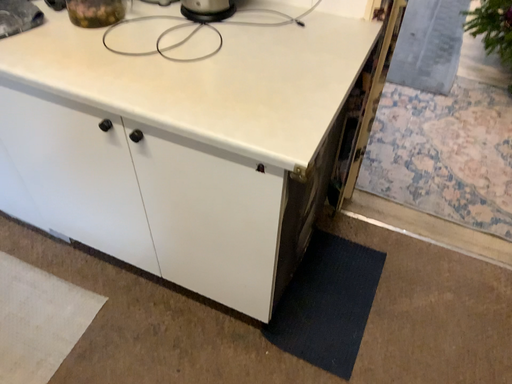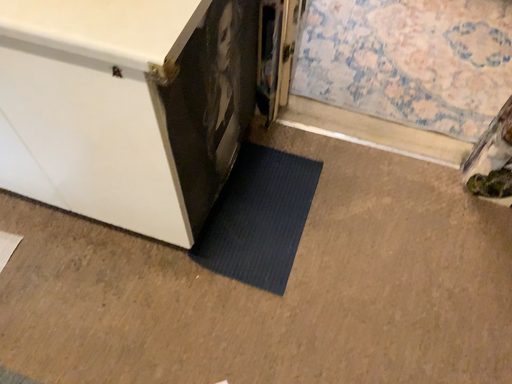
Question: Which way did the camera rotate in the video?

Choices:
 (A) rotated upward
 (B) rotated downward

Answer: (B)